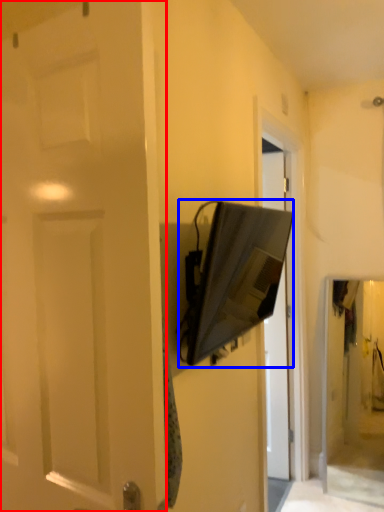
Question: Which object is closer to the camera taking this photo, door (highlighted by a red box) or medicine cabinet (highlighted by a blue box)?

Choices:
 (A) door
 (B) medicine cabinet

Answer: (A)